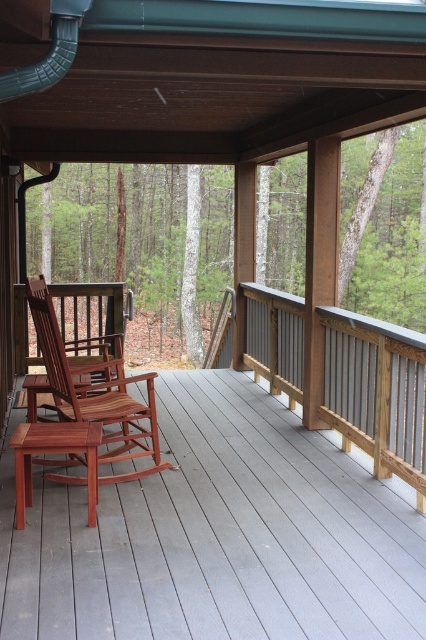
You are standing on the porch and want to place a 2.5 meter long wooden bench between the gray wood rail at right and the mahogany wood rocking chair at center. Is there enough space for the bench?

The distance between the gray wood rail at right and the mahogany wood rocking chair at center is 2.24 meters. Since the bench is 2.5 meters long, it is longer than the available space, so the bench will not fit between them.

You are standing on the smooth gray wood deck at center and want to place a tall potted plant on it. The potted plant is 1.2 meters tall. The gray wood rail at right is nearby. Can the potted plant be placed on the deck without touching the rail?

The smooth gray wood deck at center is not as tall as the gray wood rail at right. Since the deck is shorter, placing a 1.2 meter tall potted plant on it would not cause the plant to touch the rail, as the rail is taller and positioned at the right side.